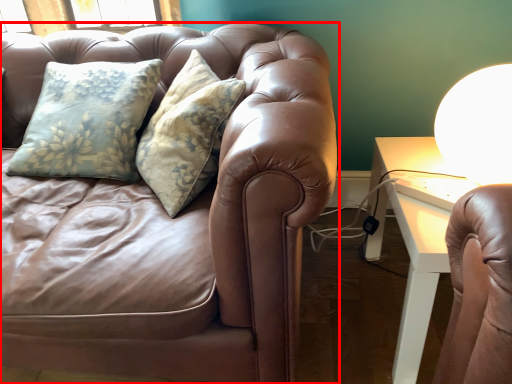
Question: Observing the image, what is the correct spatial positioning of studio couch (annotated by the red box) in reference to table lamp?

Choices:
 (A) right
 (B) left

Answer: (B)